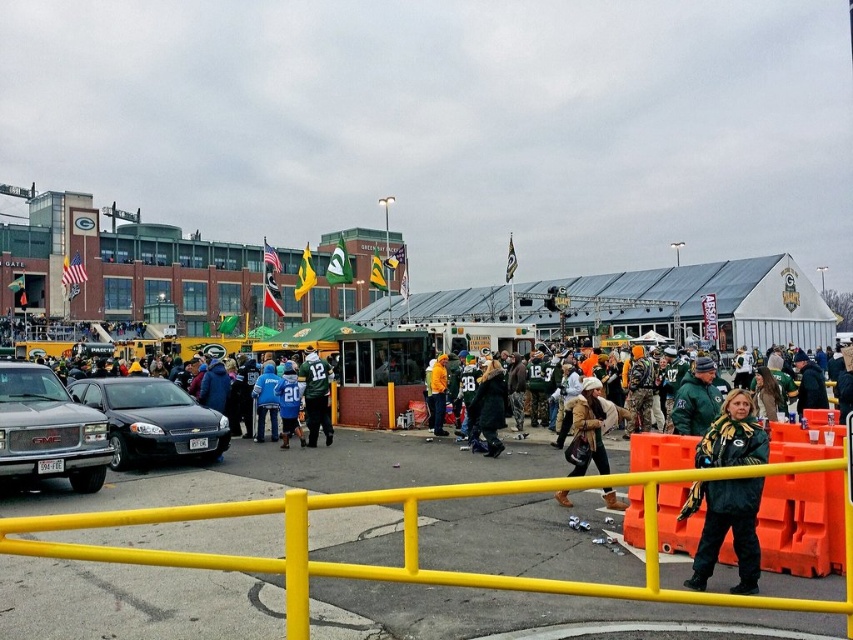
Is yellow plastic barricade at center wider than green fabric scarf at center?

No.

From the picture: Can you confirm if yellow plastic barricade at center is positioned above green fabric scarf at center?

Yes.

The height and width of the screenshot is (640, 853). What are the coordinates of `yellow plastic barricade at center` in the screenshot? It's located at (422, 538).

This screenshot has height=640, width=853. What do you see at coordinates (48, 429) in the screenshot?
I see `silver metallic truck at left` at bounding box center [48, 429].

Is silver metallic truck at left taller than green fabric scarf at center?

Yes, silver metallic truck at left is taller than green fabric scarf at center.

Who is more forward, (68, 397) or (737, 480)?

Positioned in front is point (737, 480).

The width and height of the screenshot is (853, 640). What are the coordinates of `silver metallic truck at left` in the screenshot? It's located at (48, 429).

Is black fuzzy coat at center below orange matte jacket at center?

No, black fuzzy coat at center is not below orange matte jacket at center.

Measure the distance between black fuzzy coat at center and orange matte jacket at center.

black fuzzy coat at center and orange matte jacket at center are 3.14 meters apart from each other.

Which is behind, point (496, 362) or point (440, 380)?

Point (440, 380)

Where is `black fuzzy coat at center`? This screenshot has width=853, height=640. black fuzzy coat at center is located at coordinates (489, 406).